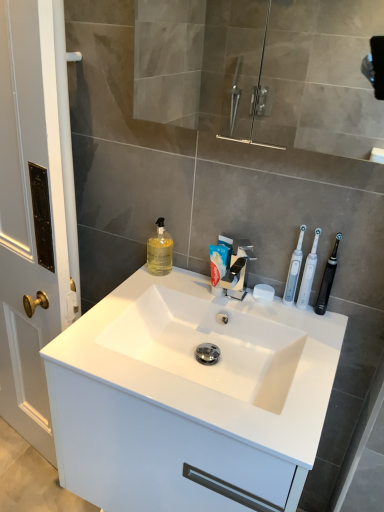
Locate an element on the screen. The width and height of the screenshot is (384, 512). free space in front of white matte soap at center is located at coordinates (285, 329).